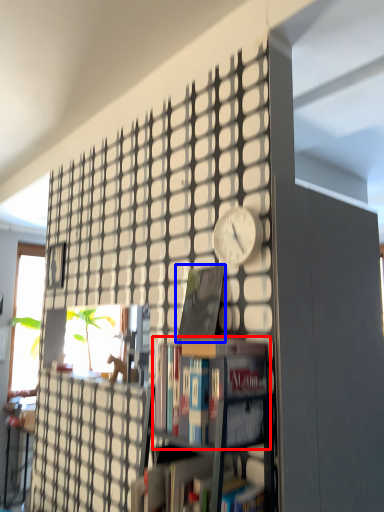
Question: Which object appears closest to the camera in this image, book (highlighted by a red box) or book (highlighted by a blue box)?

Choices:
 (A) book
 (B) book

Answer: (A)